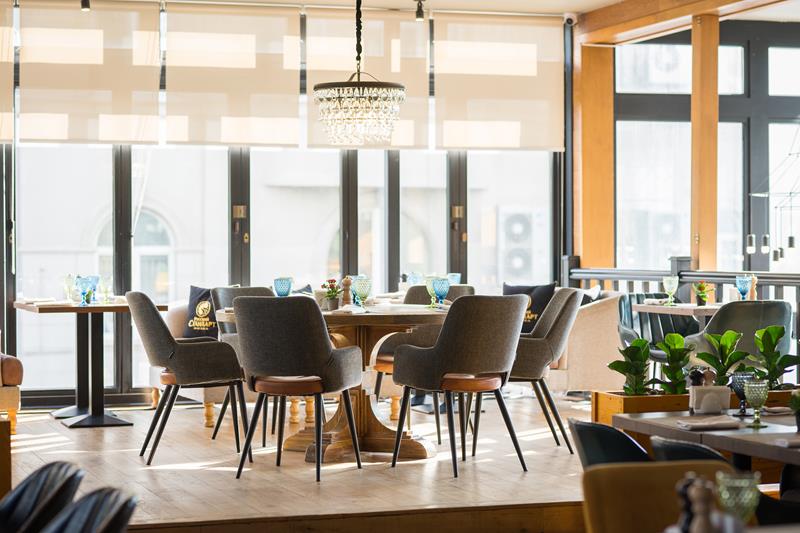
In order to click on windows in this screenshot , I will do `click(82, 227)`, `click(180, 220)`, `click(298, 213)`, `click(370, 205)`, `click(421, 204)`, `click(497, 204)`, `click(625, 197)`, `click(634, 88)`, `click(781, 83)`, `click(781, 159)`.